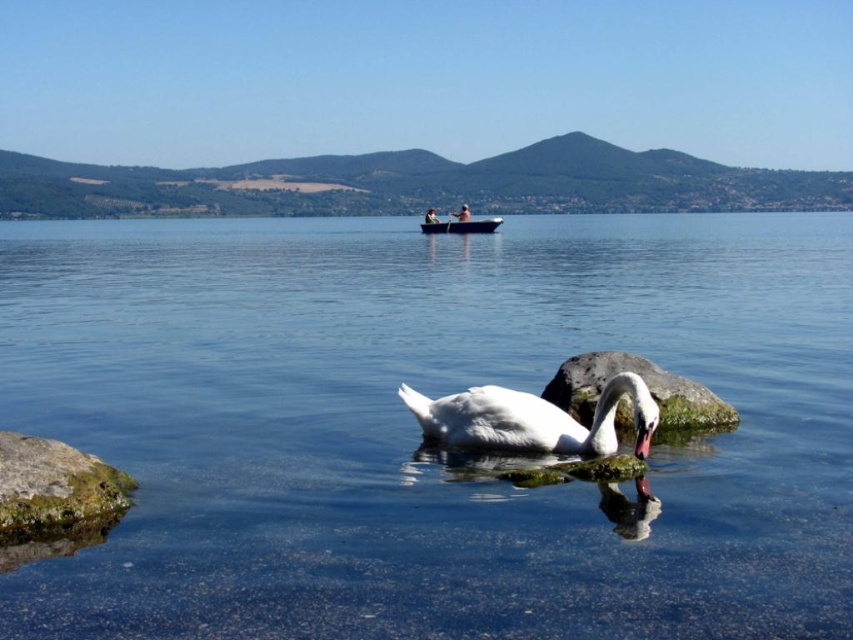
You are standing at the edge of the lake and see the clear water at center and the gray smooth rock at center. Which object is located to the left side from your perspective?

The clear water at center is located to the left of the gray smooth rock at center from your perspective.

You are standing on the lakeside and see the white glossy swan at center and the blue glossy boat at center. Which object is nearer to you?

The white glossy swan at center is closer to the viewer than the blue glossy boat at center.